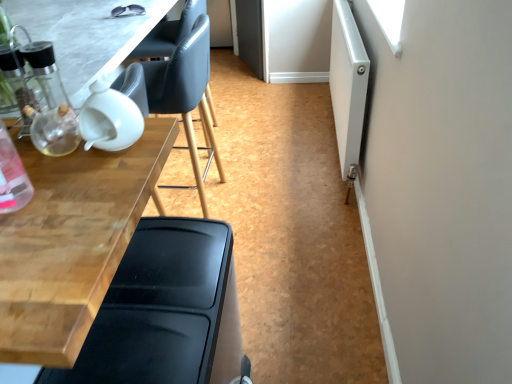
Question: Is transparent glass table at upper left, placed as the first table when sorted from top to bottom, positioned in front of white matte screen door at right?

Choices:
 (A) yes
 (B) no

Answer: (A)

Question: Does transparent glass table at upper left, placed as the first table when sorted from top to bottom, have a larger size compared to white matte screen door at right?

Choices:
 (A) yes
 (B) no

Answer: (B)

Question: Is white matte screen door at right a part of transparent glass table at upper left, the second table positioned from the bottom?

Choices:
 (A) yes
 (B) no

Answer: (B)

Question: Can you confirm if transparent glass table at upper left, placed as the first table when sorted from top to bottom, is shorter than white matte screen door at right?

Choices:
 (A) yes
 (B) no

Answer: (A)

Question: From a real-world perspective, is transparent glass table at upper left, placed as the first table when sorted from top to bottom, positioned over white matte screen door at right based on gravity?

Choices:
 (A) yes
 (B) no

Answer: (A)

Question: Is transparent glass table at upper left, placed as the first table when sorted from top to bottom, at the right side of white matte screen door at right?

Choices:
 (A) yes
 (B) no

Answer: (B)

Question: Considering the relative sizes of wooden table at left, which is the 2th table from top to bottom, and black plastic chair at lower left, marked as the first chair in a front-to-back arrangement, in the image provided, is wooden table at left, which is the 2th table from top to bottom, thinner than black plastic chair at lower left, marked as the first chair in a front-to-back arrangement,?

Choices:
 (A) no
 (B) yes

Answer: (A)

Question: From the image's perspective, does wooden table at left, which is the 2th table from top to bottom, appear lower than black plastic chair at lower left, which is the 1th chair from bottom to top?

Choices:
 (A) yes
 (B) no

Answer: (B)

Question: Considering the relative sizes of wooden table at left, which is the 2th table from top to bottom, and black plastic chair at lower left, marked as the 2th chair in a top-to-bottom arrangement, in the image provided, is wooden table at left, which is the 2th table from top to bottom, taller than black plastic chair at lower left, marked as the 2th chair in a top-to-bottom arrangement,?

Choices:
 (A) yes
 (B) no

Answer: (A)

Question: From the image's perspective, is wooden table at left, which is the 2th table from top to bottom, on top of black plastic chair at lower left, marked as the first chair in a front-to-back arrangement?

Choices:
 (A) no
 (B) yes

Answer: (B)

Question: Is wooden table at left, which is the 2th table from top to bottom, to the right of black plastic chair at lower left, which is the 1th chair from bottom to top, from the viewer's perspective?

Choices:
 (A) no
 (B) yes

Answer: (A)

Question: Considering the relative sizes of wooden table at left, which is the 2th table from top to bottom, and black plastic chair at lower left, marked as the first chair in a front-to-back arrangement, in the image provided, is wooden table at left, which is the 2th table from top to bottom, bigger than black plastic chair at lower left, marked as the first chair in a front-to-back arrangement,?

Choices:
 (A) yes
 (B) no

Answer: (A)

Question: From the image's perspective, is white matte screen door at right located beneath black plastic chair at lower left, the second chair viewed from the back?

Choices:
 (A) no
 (B) yes

Answer: (A)